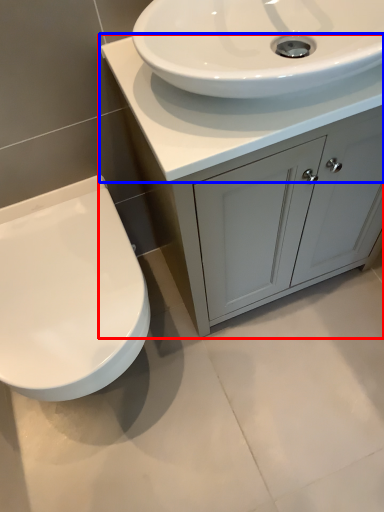
Question: Among these objects, which one is nearest to the camera, bathroom cabinet (highlighted by a red box) or counter top (highlighted by a blue box)?

Choices:
 (A) bathroom cabinet
 (B) counter top

Answer: (B)